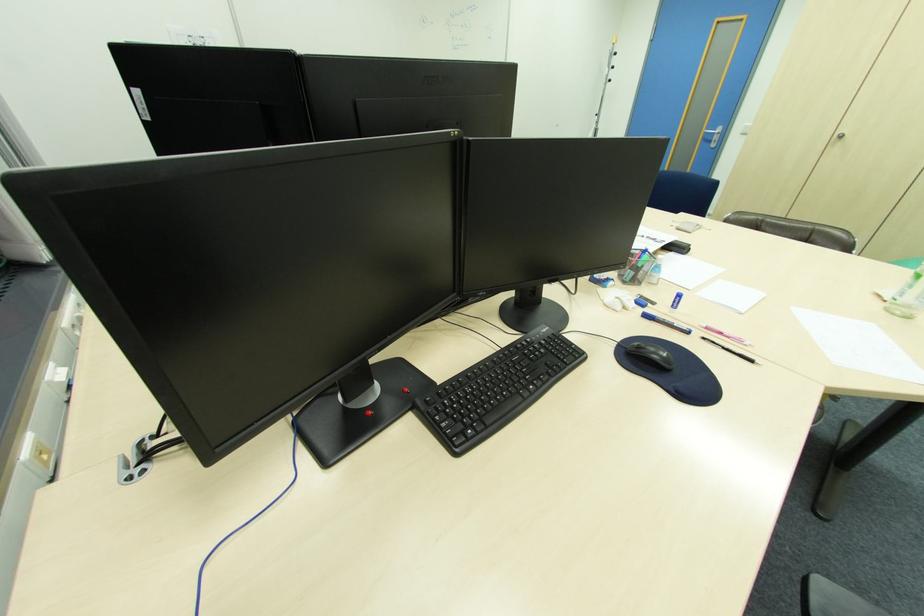
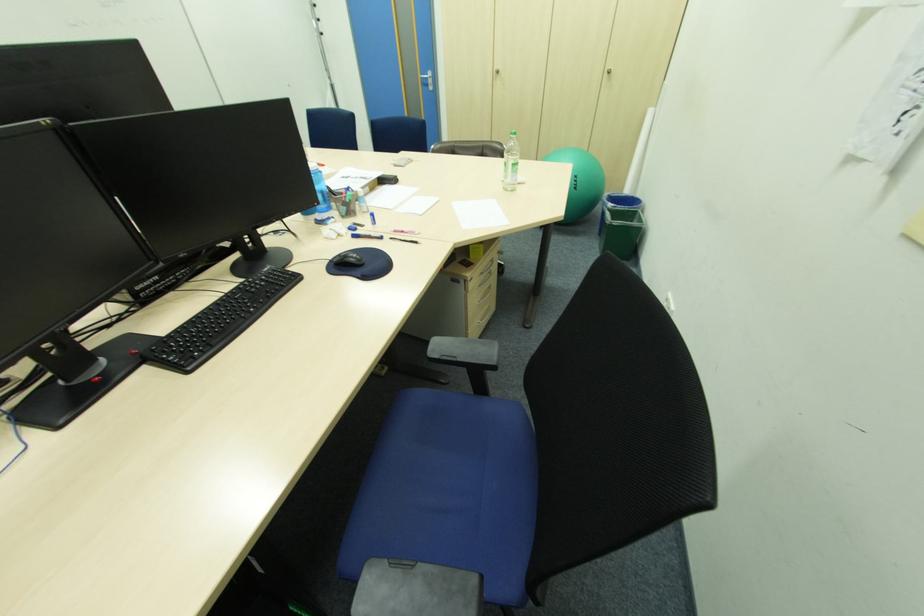
In the second image, find the point that corresponds to (894,310) in the first image.

(511, 190)